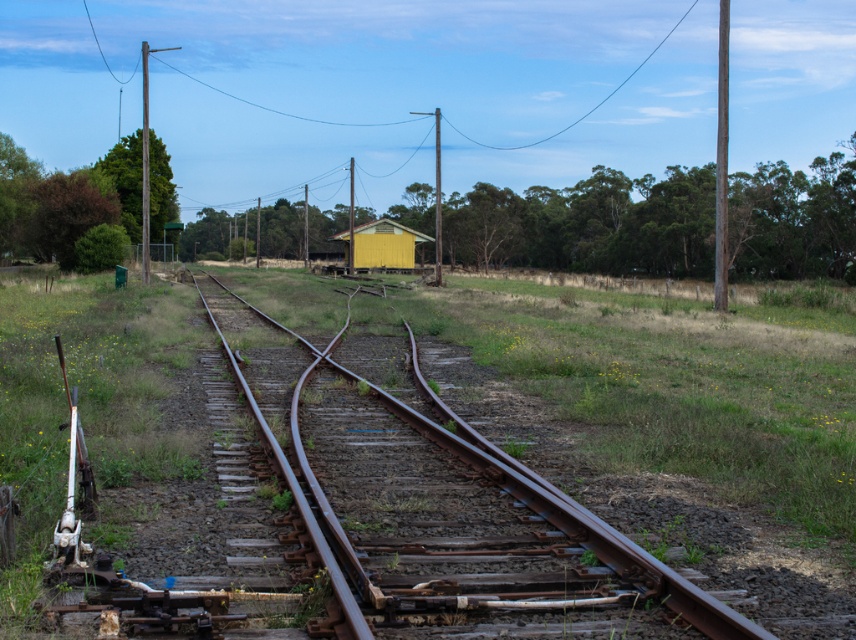
You are standing at the point with coordinates (571, 515) in the image. What object are you standing on?

You are standing on the rusty metal track at center.

You are a railway inspector checking the tracks. You see the rusty metal track at center and the yellow wood hut at center. Which object is positioned lower in the image?

The rusty metal track at center is positioned lower than the yellow wood hut at center in the image.

You are standing at the point closer to the camera in the image. Which point are you at, point (x=510, y=474) or point (x=421, y=237)?

You are at point (x=510, y=474) because it is closer to the camera than point (x=421, y=237).